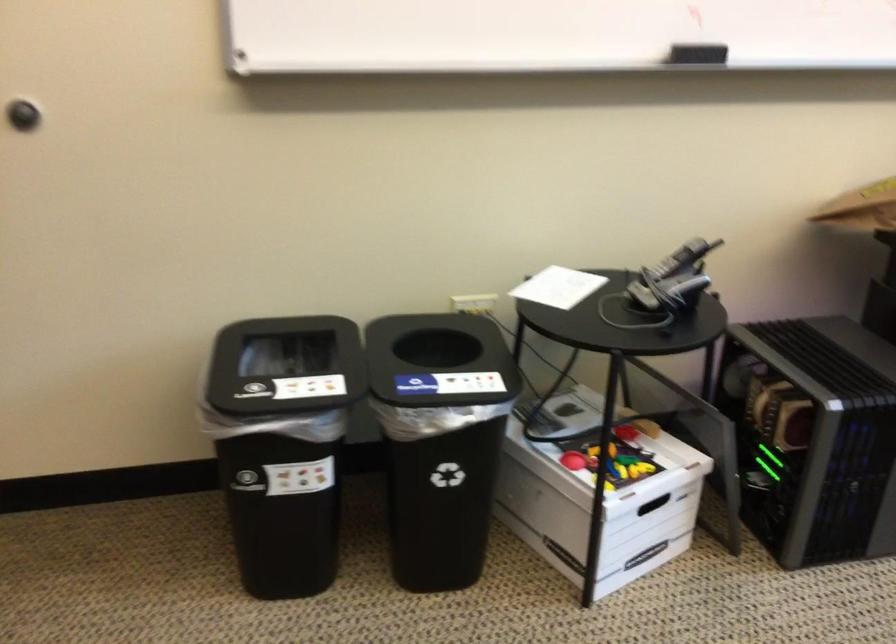
Which object does [696,53] point to?

It refers to a black whiteboard eraser.